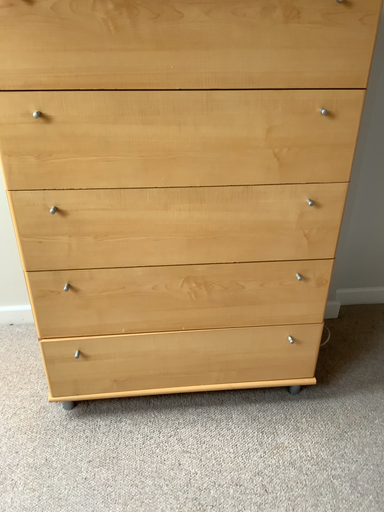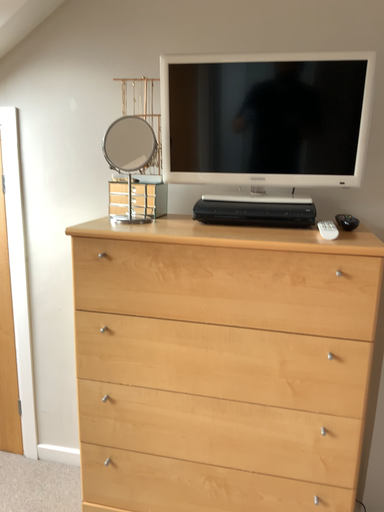
Question: How did the camera likely rotate when shooting the video?

Choices:
 (A) rotated upward
 (B) rotated downward

Answer: (A)